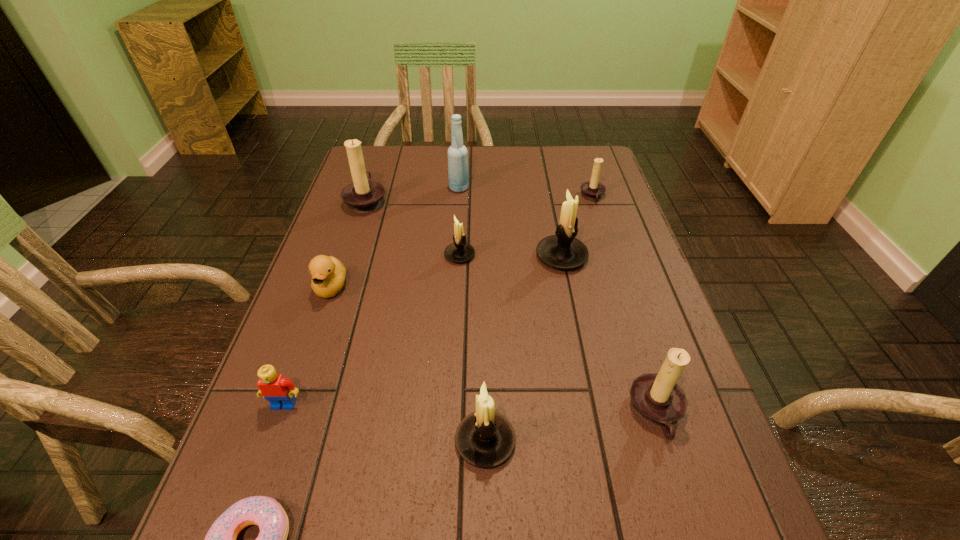
The width and height of the screenshot is (960, 540). In order to click on free area in between the duckling and the red Lego in this screenshot , I will do `click(308, 346)`.

Where is `object that is the seventh closest to the leftmost brown candle holder`? Image resolution: width=960 pixels, height=540 pixels. object that is the seventh closest to the leftmost brown candle holder is located at coordinates (485, 439).

What are the coordinates of `object identified as the third closest to the second smallest white candle holder` in the screenshot? It's located at (276, 389).

Choose which candle holder is the third nearest neighbor to the red Lego. Please provide its 2D coordinates. Your answer should be formatted as a tuple, i.e. [(x, y)], where the tuple contains the x and y coordinates of a point satisfying the conditions above.

[(364, 195)]

Locate which candle holder ranks fourth in proximity to the smallest brown candle holder. Please provide its 2D coordinates. Your answer should be formatted as a tuple, i.e. [(x, y)], where the tuple contains the x and y coordinates of a point satisfying the conditions above.

[(657, 398)]

Identify the location of brown candle holder that is the second closest one to the second smallest brown candle holder. (364, 195).

Point out which brown candle holder is positioned as the second nearest to the nearest white candle holder. Please provide its 2D coordinates. Your answer should be formatted as a tuple, i.e. [(x, y)], where the tuple contains the x and y coordinates of a point satisfying the conditions above.

[(364, 195)]

Identify which white candle holder is the closest to the leftmost candle holder. Please provide its 2D coordinates. Your answer should be formatted as a tuple, i.e. [(x, y)], where the tuple contains the x and y coordinates of a point satisfying the conditions above.

[(459, 251)]

Point out which white candle holder is positioned as the nearest to the smallest white candle holder. Please provide its 2D coordinates. Your answer should be formatted as a tuple, i.e. [(x, y)], where the tuple contains the x and y coordinates of a point satisfying the conditions above.

[(562, 251)]

The height and width of the screenshot is (540, 960). What are the coordinates of `vacant space that satisfies the following two spatial constraints: 1. on the wick of the biggest brown candle holder; 2. on the face of the duckling` in the screenshot? It's located at (338, 287).